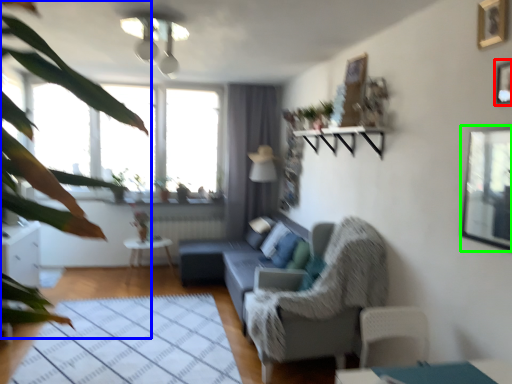
Question: Which is farther away from picture frame (highlighted by a red box)? vegetation (highlighted by a blue box) or window screen (highlighted by a green box)?

Choices:
 (A) vegetation
 (B) window screen

Answer: (A)